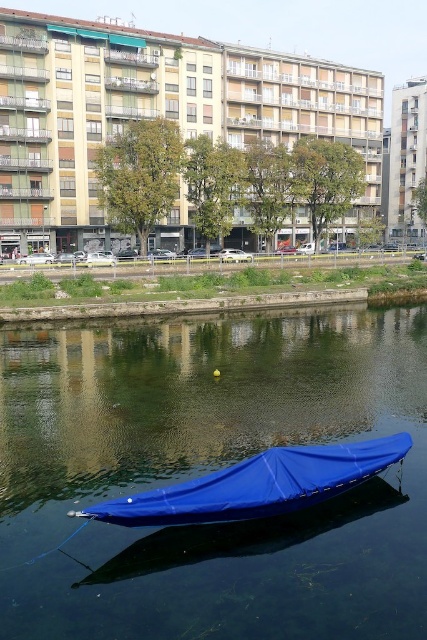
Question: Does blue fabric boat at lower center appear on the right side of blue tarpaulin boat at center?

Choices:
 (A) no
 (B) yes

Answer: (A)

Question: Which point is closer to the camera?

Choices:
 (A) (403, 484)
 (B) (280, 461)

Answer: (B)

Question: Does blue fabric boat at lower center have a lesser width compared to blue tarpaulin boat at center?

Choices:
 (A) no
 (B) yes

Answer: (A)

Question: Does blue fabric boat at lower center come in front of blue tarpaulin boat at center?

Choices:
 (A) yes
 (B) no

Answer: (A)

Question: Among these objects, which one is nearest to the camera?

Choices:
 (A) blue tarpaulin boat at center
 (B) blue fabric boat at lower center

Answer: (B)